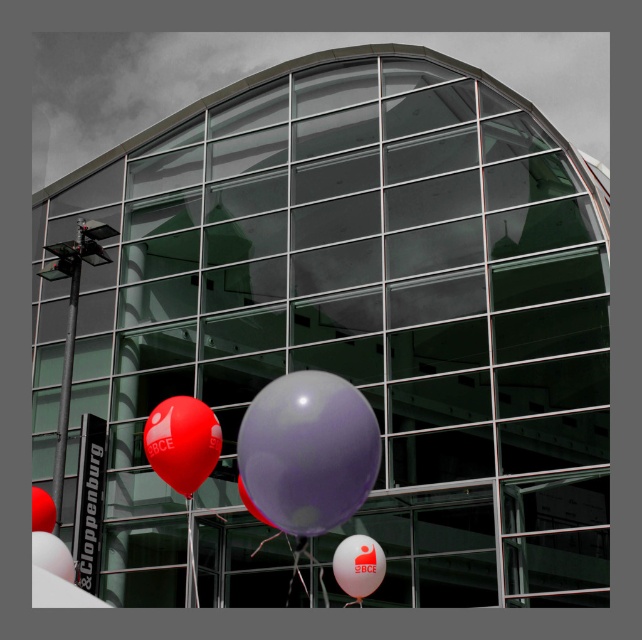
Question: Which object is closer to the camera taking this photo?

Choices:
 (A) purple matte balloon at center
 (B) rubber matte balloon at lower center
 (C) purple glossy balloon at center

Answer: (C)

Question: Does purple glossy balloon at center have a larger size compared to matte white balloon at lower left?

Choices:
 (A) no
 (B) yes

Answer: (B)

Question: Can you confirm if matte red balloon at center is thinner than matte white balloon at lower left?

Choices:
 (A) no
 (B) yes

Answer: (A)

Question: Considering the real-world distances, which object is closest to the matte red balloon at center?

Choices:
 (A) matte white balloon at lower left
 (B) rubber matte balloon at lower center

Answer: (A)

Question: Does purple glossy balloon at center appear over translucent white balloon at lower center?

Choices:
 (A) no
 (B) yes

Answer: (B)

Question: Which object appears closest to the camera in this image?

Choices:
 (A) translucent white balloon at lower center
 (B) purple matte balloon at center
 (C) rubber matte balloon at lower center
 (D) matte red balloon at center

Answer: (B)